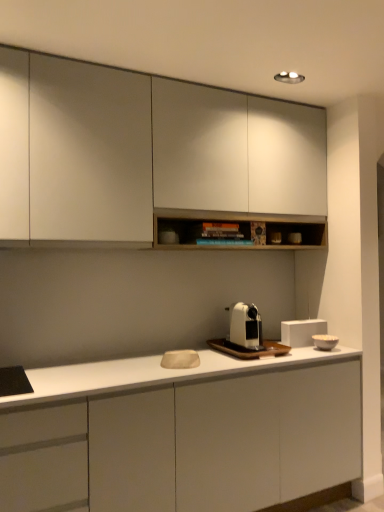
Question: Is white matte rectangular box at center, which ranks as the first appliance in back-to-front order, far from white matte bowl at right, placed as the 2th appliance when sorted from back to front?

Choices:
 (A) yes
 (B) no

Answer: (B)

Question: Is white matte rectangular box at center, the second appliance positioned from the front, taller than white matte bowl at right, placed as the 2th appliance when sorted from back to front?

Choices:
 (A) no
 (B) yes

Answer: (B)

Question: Is white matte rectangular box at center, the second appliance positioned from the front, turned away from white matte bowl at right, placed as the 2th appliance when sorted from back to front?

Choices:
 (A) no
 (B) yes

Answer: (A)

Question: From the image's perspective, is white matte rectangular box at center, the second appliance positioned from the front, on white matte bowl at right, positioned as the first appliance in front-to-back order?

Choices:
 (A) yes
 (B) no

Answer: (A)

Question: Is white matte rectangular box at center, which ranks as the first appliance in back-to-front order, shorter than white matte bowl at right, placed as the 2th appliance when sorted from back to front?

Choices:
 (A) yes
 (B) no

Answer: (B)

Question: Is white matte rectangular box at center, the second appliance positioned from the front, outside of white matte bowl at right, placed as the 2th appliance when sorted from back to front?

Choices:
 (A) no
 (B) yes

Answer: (B)

Question: Is white matte coffee machine at center closer to the viewer compared to white matte rectangular box at center, the second appliance positioned from the front?

Choices:
 (A) no
 (B) yes

Answer: (B)

Question: Is white matte coffee machine at center directly adjacent to white matte rectangular box at center, the second appliance positioned from the front?

Choices:
 (A) yes
 (B) no

Answer: (B)

Question: Considering the relative sizes of white matte coffee machine at center and white matte rectangular box at center, which ranks as the first appliance in back-to-front order, in the image provided, is white matte coffee machine at center wider than white matte rectangular box at center, which ranks as the first appliance in back-to-front order,?

Choices:
 (A) yes
 (B) no

Answer: (A)

Question: Can you confirm if white matte coffee machine at center is thinner than white matte rectangular box at center, the second appliance positioned from the front?

Choices:
 (A) no
 (B) yes

Answer: (A)

Question: Considering the relative sizes of white matte coffee machine at center and white matte rectangular box at center, which ranks as the first appliance in back-to-front order, in the image provided, is white matte coffee machine at center smaller than white matte rectangular box at center, which ranks as the first appliance in back-to-front order,?

Choices:
 (A) no
 (B) yes

Answer: (B)

Question: Is white matte coffee machine at center at the right side of white matte rectangular box at center, the second appliance positioned from the front?

Choices:
 (A) no
 (B) yes

Answer: (A)

Question: Is white matte cabinet at center, which appears as the second cabinetry when viewed from the top, further to the viewer compared to matte white cabinet at upper center, which is the 2th cabinetry in bottom-to-top order?

Choices:
 (A) yes
 (B) no

Answer: (B)